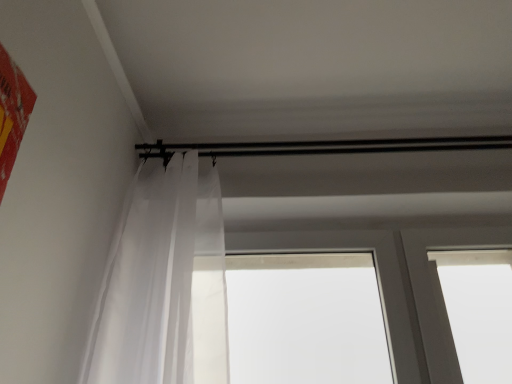
Question: From the image's perspective, would you say translucent fabric curtain at left is shown under transparent plastic window at center?

Choices:
 (A) no
 (B) yes

Answer: (A)

Question: From a real-world perspective, is translucent fabric curtain at left under transparent plastic window at center?

Choices:
 (A) no
 (B) yes

Answer: (A)

Question: Is translucent fabric curtain at left far away from transparent plastic window at center?

Choices:
 (A) no
 (B) yes

Answer: (A)

Question: Can you confirm if translucent fabric curtain at left is taller than transparent plastic window at center?

Choices:
 (A) no
 (B) yes

Answer: (B)

Question: Is transparent plastic window at center surrounded by translucent fabric curtain at left?

Choices:
 (A) no
 (B) yes

Answer: (A)

Question: Is translucent fabric curtain at left facing away from transparent plastic window at center?

Choices:
 (A) yes
 (B) no

Answer: (A)

Question: Is transparent plastic window at center behind translucent fabric curtain at left?

Choices:
 (A) no
 (B) yes

Answer: (B)

Question: From a real-world perspective, is transparent plastic window at center over translucent fabric curtain at left?

Choices:
 (A) yes
 (B) no

Answer: (B)

Question: Is transparent plastic window at center positioned in front of translucent fabric curtain at left?

Choices:
 (A) no
 (B) yes

Answer: (A)

Question: Is transparent plastic window at center oriented away from translucent fabric curtain at left?

Choices:
 (A) yes
 (B) no

Answer: (B)

Question: Can you confirm if transparent plastic window at center is bigger than translucent fabric curtain at left?

Choices:
 (A) no
 (B) yes

Answer: (A)

Question: From the image's perspective, is transparent plastic window at center on top of translucent fabric curtain at left?

Choices:
 (A) no
 (B) yes

Answer: (A)

Question: From a real-world perspective, is translucent fabric curtain at left positioned above or below transparent plastic window at center?

Choices:
 (A) below
 (B) above

Answer: (B)